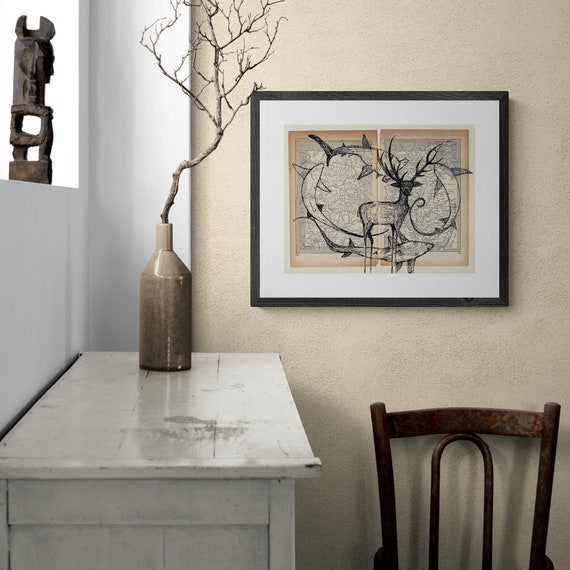
Locate an element on the screen. The width and height of the screenshot is (570, 570). 2 different color walls is located at coordinates (40, 308), (365, 357).